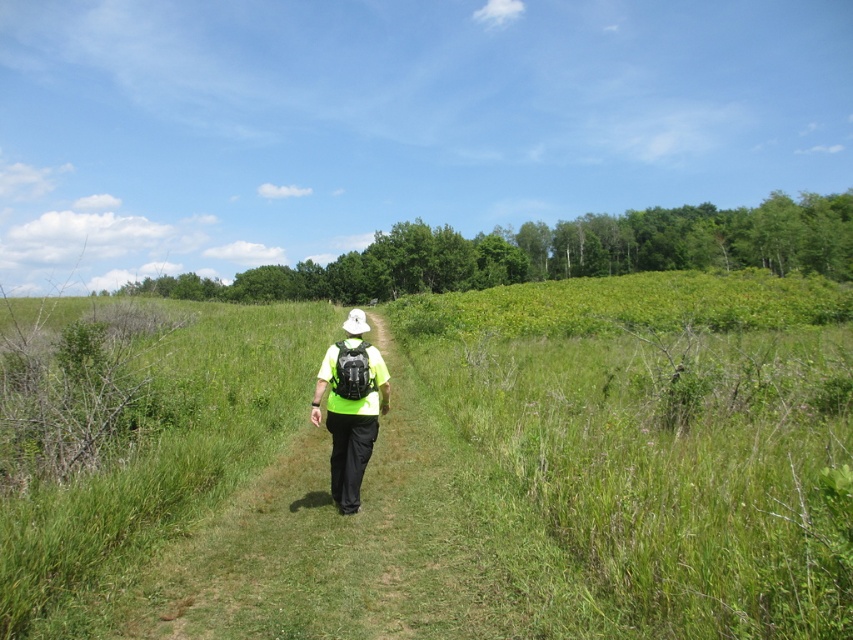
You are the hiker in the image. You want to place a small water bottle on the ground in front of you. Where should you place it so that it sits on the matte black backpack at center but not on the green grassy at center?

The green grassy at center is positioned over matte black backpack at center, so you should place the water bottle underneath the green grassy at center where the matte black backpack at center is located to avoid placing it on the grass.

You are a drone operator trying to capture a photo of the person hiking. The green grassy at center and matte black backpack at center are in your camera frame. Your camera has a minimum focus distance of 10 meters. Can you focus on both objects simultaneously?

The green grassy at center and matte black backpack at center are 13.34 meters apart. Since the distance between them is greater than the camera minimum focus distance of 10 meters, the camera can focus on both objects simultaneously.

You are a hiker who wants to ensure your backpack doesn not get damaged by the tall grass. Based on the scene, will the matte black backpack at center be fully visible above the green grassy at center?

The green grassy at center has a greater height compared to matte black backpack at center, so the backpack will not be fully visible above the grass.